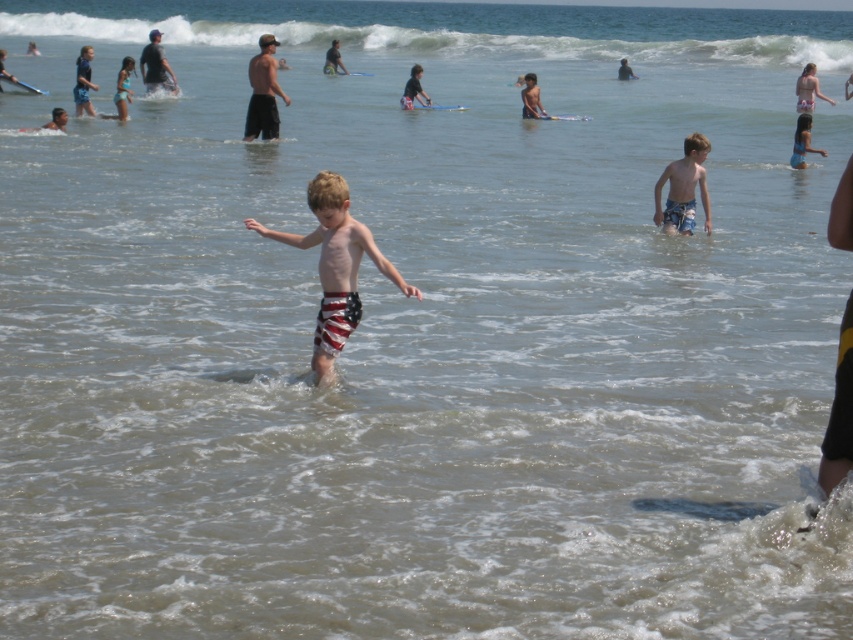
Question: Among these points, which one is nearest to the camera?

Choices:
 (A) (618, 72)
 (B) (408, 102)
 (C) (167, 67)

Answer: (C)

Question: Does dark blue shirt at upper left have a smaller size compared to blue swim trunks at upper center?

Choices:
 (A) no
 (B) yes

Answer: (A)

Question: Considering the real-world distances, which object is closest to the dark gray fabric shirt at center?

Choices:
 (A) dark blue shirt at upper left
 (B) white striped shorts at upper right

Answer: (A)

Question: Is matte black shorts at upper center further to the viewer compared to striped swim trunks at center?

Choices:
 (A) yes
 (B) no

Answer: (B)

Question: Is dark gray fabric shirt at center to the right of blue swim trunks at upper center from the viewer's perspective?

Choices:
 (A) no
 (B) yes

Answer: (A)

Question: Which of these objects is positioned farthest from the dark blue shirt at upper left?

Choices:
 (A) dark gray fabric shirt at center
 (B) matte black shorts at upper center
 (C) blue swim trunks at upper center

Answer: (C)